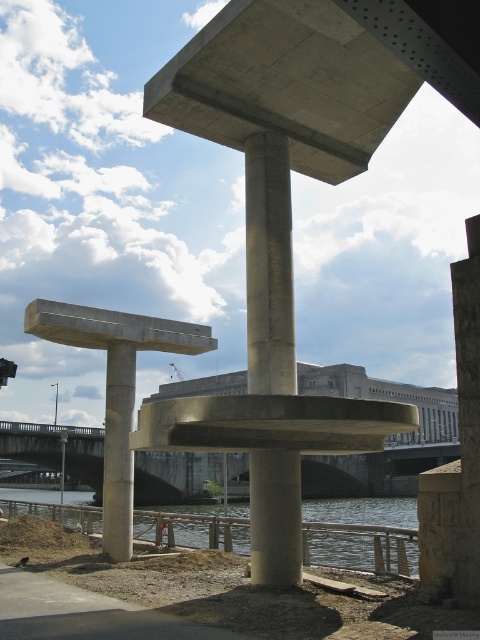
Question: Which point is farther to the camera?

Choices:
 (A) (113, 474)
 (B) (255, 218)

Answer: (A)

Question: Which object is farther from the camera taking this photo?

Choices:
 (A) concrete/rough pillar at lower center
 (B) concrete bridge at center
 (C) gray concrete at lower center
 (D) concrete at center

Answer: (B)

Question: Can you confirm if concrete bridge at center is thinner than gray concrete at lower center?

Choices:
 (A) no
 (B) yes

Answer: (A)

Question: Which of the following is the farthest from the observer?

Choices:
 (A) tap(141, 484)
 (B) tap(200, 541)

Answer: (A)

Question: Does concrete at center appear on the right side of concrete/rough pillar at lower center?

Choices:
 (A) yes
 (B) no

Answer: (A)

Question: From the image, what is the correct spatial relationship of concrete at center in relation to concrete bridge at center?

Choices:
 (A) left
 (B) right

Answer: (B)